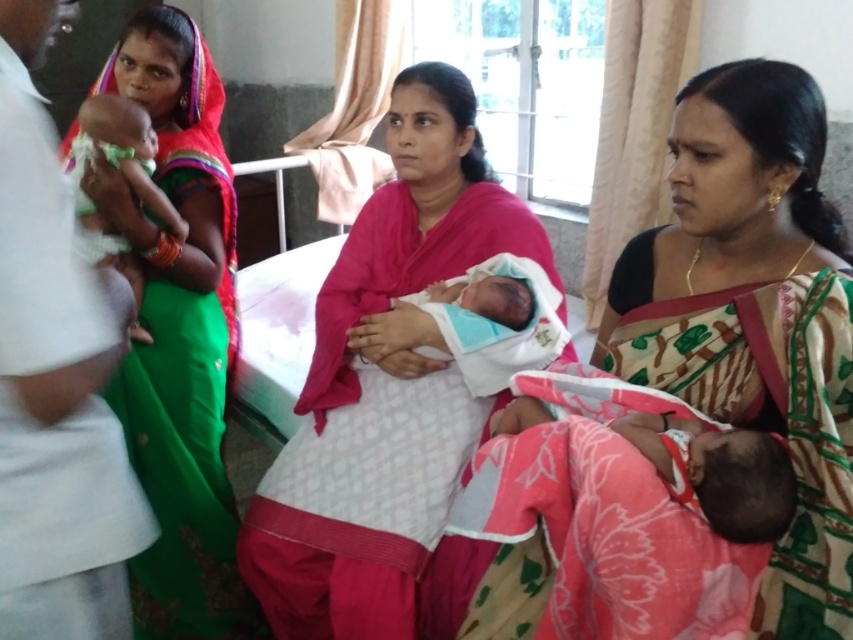
In the hospital room scene, there is a printed cotton sari at center and a matte green fabric baby at left. From the perspective of someone standing at the doorway facing into the room, which object is positioned to the right of the other?

The printed cotton sari at center is to the right of the matte green fabric baby at left.

You are a photographer positioned in front of the scene. You want to capture a closeup of the printed cotton sari at center and the soft blue swaddle at center. Which object should you focus on first to ensure both are in sharp focus?

The printed cotton sari at center is closer to the viewer than the soft blue swaddle at center, so you should focus on the printed cotton sari at center first to ensure both are in sharp focus.